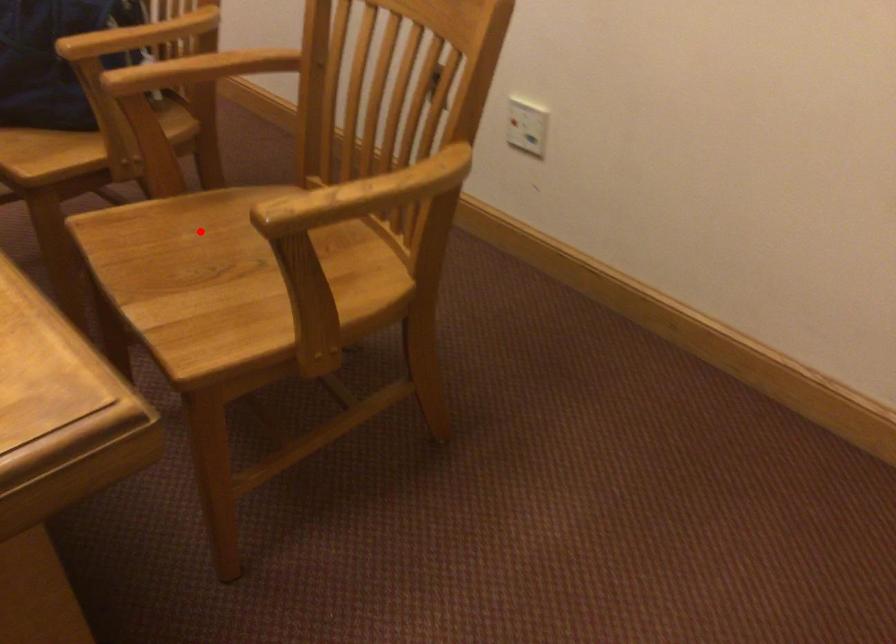
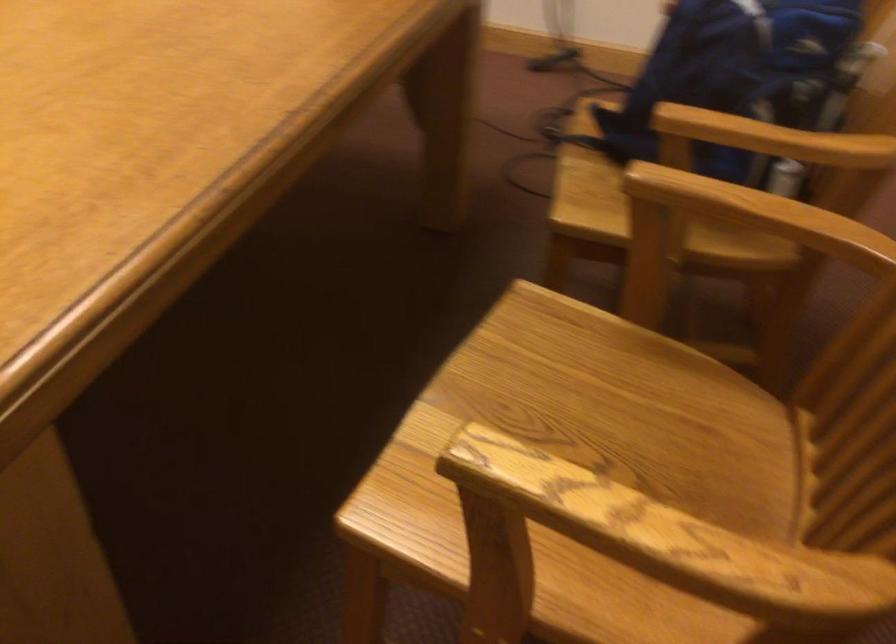
Question: A red point is marked in image1. In image2, is the corresponding 3D point closer to the camera or farther? Reply with the corresponding letter.

Choices:
 (A) The corresponding 3D point is closer.
 (B) The corresponding 3D point is farther.

Answer: (A)